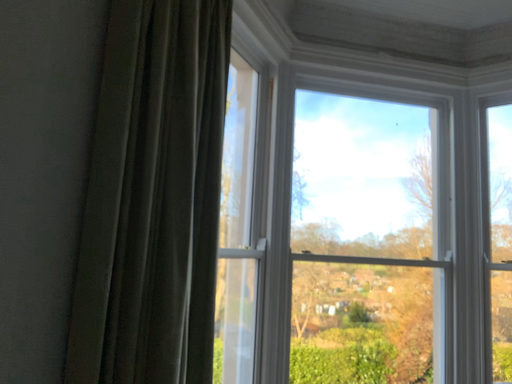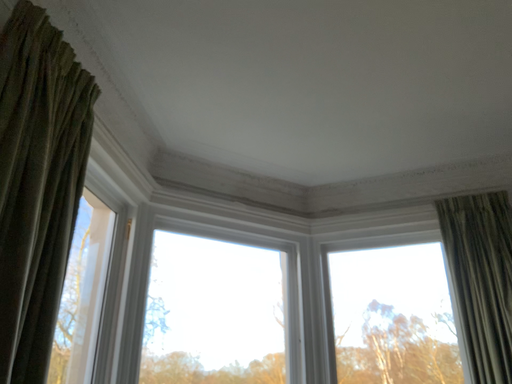
Question: How did the camera likely rotate when shooting the video?

Choices:
 (A) rotated downward
 (B) rotated upward

Answer: (B)